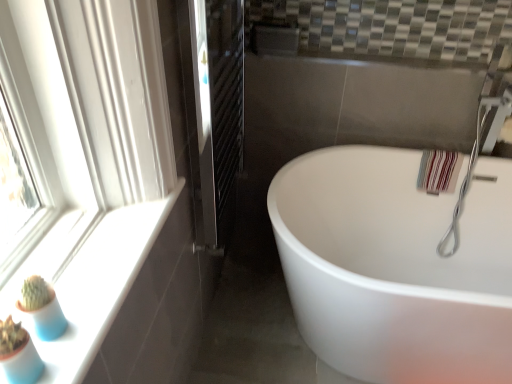
Question: Is white glossy bathtub at center to the right of white glossy window sill at lower left from the viewer's perspective?

Choices:
 (A) yes
 (B) no

Answer: (A)

Question: Could you tell me if white glossy bathtub at center is turned towards white glossy window sill at lower left?

Choices:
 (A) no
 (B) yes

Answer: (A)

Question: Is white glossy bathtub at center taller than white glossy window sill at lower left?

Choices:
 (A) no
 (B) yes

Answer: (B)

Question: Is the surface of white glossy bathtub at center in direct contact with white glossy window sill at lower left?

Choices:
 (A) no
 (B) yes

Answer: (A)

Question: Considering the relative sizes of white glossy bathtub at center and white glossy window sill at lower left in the image provided, is white glossy bathtub at center thinner than white glossy window sill at lower left?

Choices:
 (A) yes
 (B) no

Answer: (B)

Question: Based on their positions, is white glossy bathtub at center located to the left or right of silver metallic faucet at upper right?

Choices:
 (A) left
 (B) right

Answer: (A)

Question: In terms of width, does white glossy bathtub at center look wider or thinner when compared to silver metallic faucet at upper right?

Choices:
 (A) wide
 (B) thin

Answer: (A)

Question: Is white glossy bathtub at center in front of or behind silver metallic faucet at upper right in the image?

Choices:
 (A) front
 (B) behind

Answer: (A)

Question: From the image's perspective, is white glossy bathtub at center above or below silver metallic faucet at upper right?

Choices:
 (A) below
 (B) above

Answer: (A)

Question: Visually, is white glossy window sill at lower left positioned to the left or to the right of silver metallic faucet at upper right?

Choices:
 (A) right
 (B) left

Answer: (B)

Question: In terms of width, does white glossy window sill at lower left look wider or thinner when compared to silver metallic faucet at upper right?

Choices:
 (A) thin
 (B) wide

Answer: (A)

Question: From the image's perspective, is white glossy window sill at lower left located above or below silver metallic faucet at upper right?

Choices:
 (A) below
 (B) above

Answer: (A)

Question: Does point (69, 375) appear closer or farther from the camera than point (440, 253)?

Choices:
 (A) farther
 (B) closer

Answer: (B)

Question: From the image's perspective, is black metal radiator at center above or below silver metallic faucet at upper right?

Choices:
 (A) above
 (B) below

Answer: (A)

Question: Based on their positions, is black metal radiator at center located to the left or right of silver metallic faucet at upper right?

Choices:
 (A) right
 (B) left

Answer: (B)